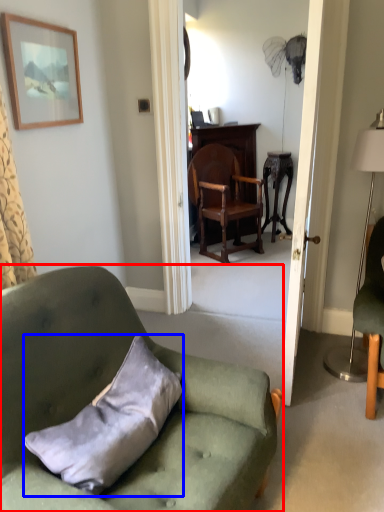
Question: Which of the following is the closest to the observer, chair (highlighted by a red box) or pillow (highlighted by a blue box)?

Choices:
 (A) chair
 (B) pillow

Answer: (A)